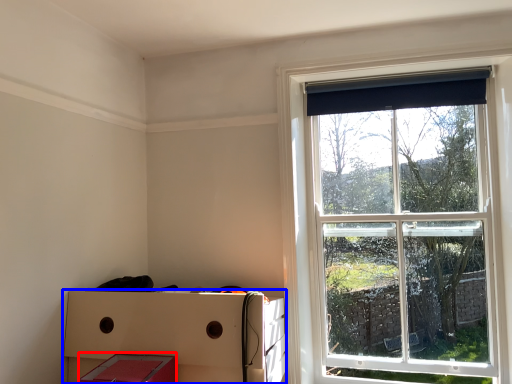
Question: Which point is closer to the camera, storage box (highlighted by a red box) or crate (highlighted by a blue box)?

Choices:
 (A) storage box
 (B) crate

Answer: (A)